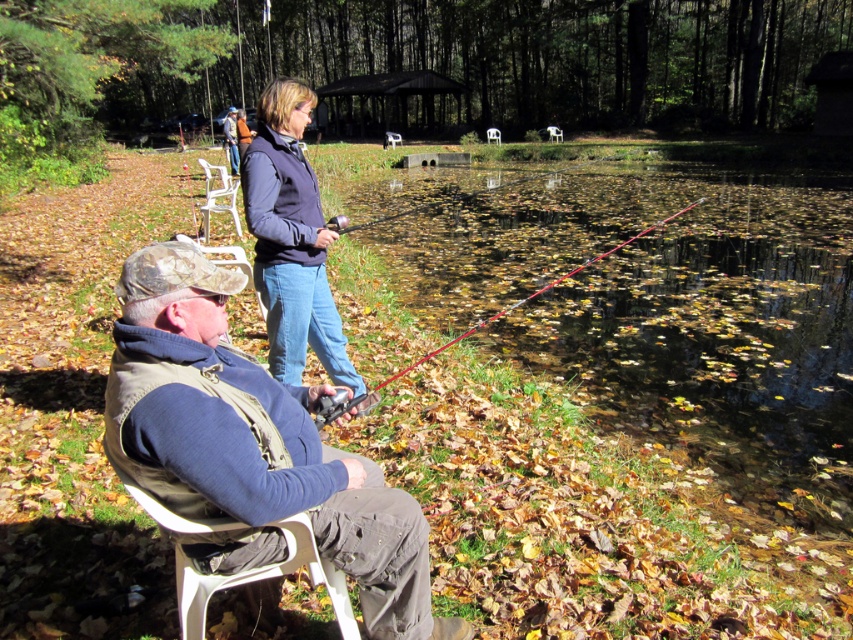
You are standing at the origin point of the coordinate system. You see two points in the scene, point (213, 404) and point (503, 184). Which point is closer to you?

Point (213, 404) is in front of point (503, 184), so it is closer to you.

Based on the photo, you are planning to place a 2 meter wide wooden bench in the scene. Given the space occupied by the translucent glass lake at center and the camouflage fabric hat at lower left, which object would allow the bench to fit next to it without overlapping?

The translucent glass lake at center has a greater width than the camouflage fabric hat at lower left, so placing the bench next to the lake would provide enough space for the bench to fit without overlapping.

You are standing at the edge of the pond and want to place a small buoy at the two points marked as point (306, 524) and point (532, 173). Which point should you place the buoy closer to the shore?

Point (306, 524) is closer to the viewer than point (532, 173), so you should place the buoy closer to the shore at point (306, 524).